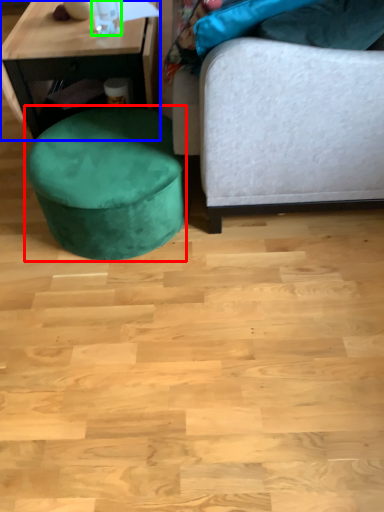
Question: Considering the real-world distances, which object is closest to music stool (highlighted by a red box)? table (highlighted by a blue box) or bottle (highlighted by a green box).

Choices:
 (A) table
 (B) bottle

Answer: (A)